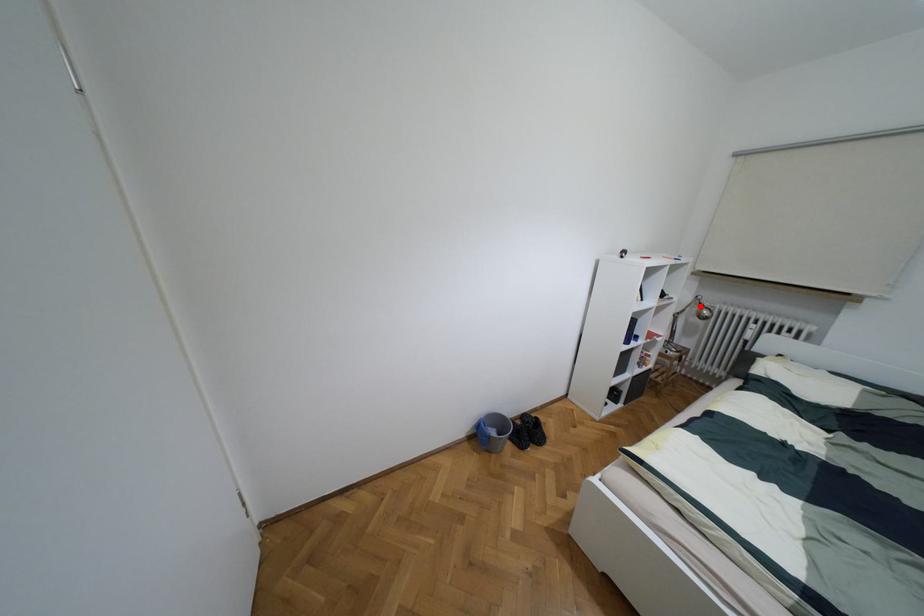
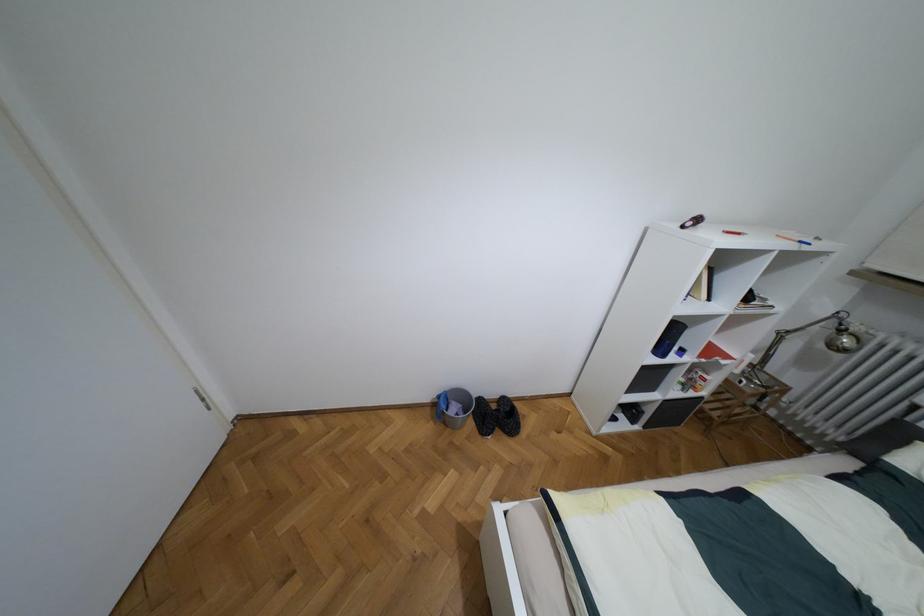
Question: A red point is marked in image1. In image2, is the corresponding 3D point closer to the camera or farther? Reply with the corresponding letter.

Choices:
 (A) The corresponding 3D point is closer.
 (B) The corresponding 3D point is farther.

Answer: (B)